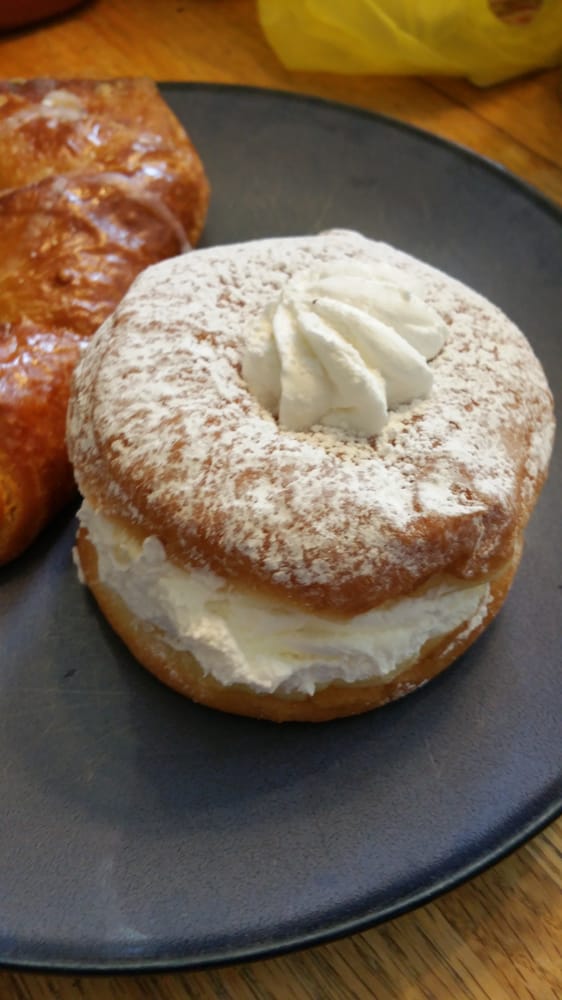
The height and width of the screenshot is (1000, 562). In order to click on plate in this screenshot , I will do `click(132, 849)`.